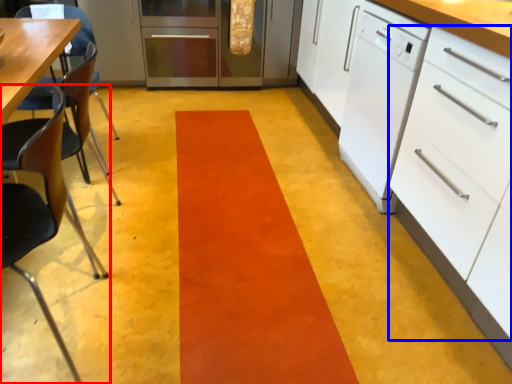
Question: Among these objects, which one is farthest to the camera, chair (highlighted by a red box) or drawer (highlighted by a blue box)?

Choices:
 (A) chair
 (B) drawer

Answer: (B)